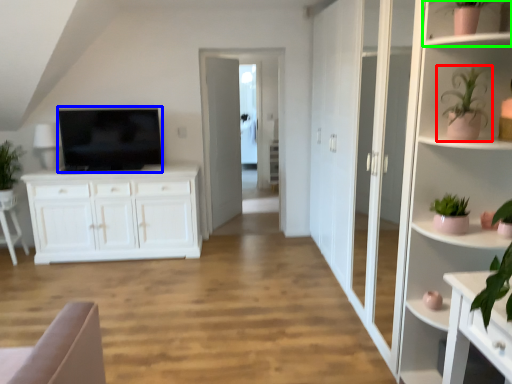
Question: Which object is the farthest from houseplant (highlighted by a red box)? Choose among these: television (highlighted by a blue box) or shelf (highlighted by a green box).

Choices:
 (A) television
 (B) shelf

Answer: (A)